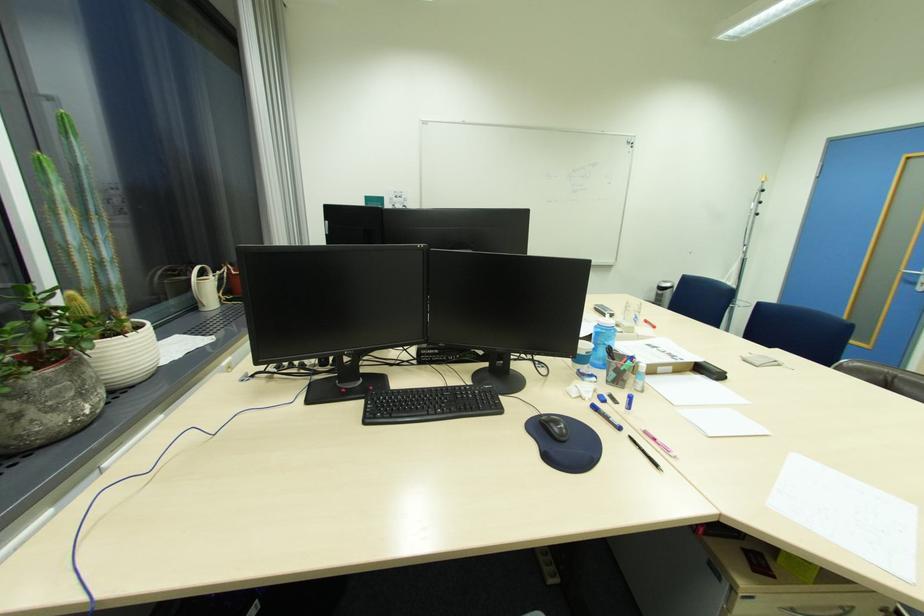
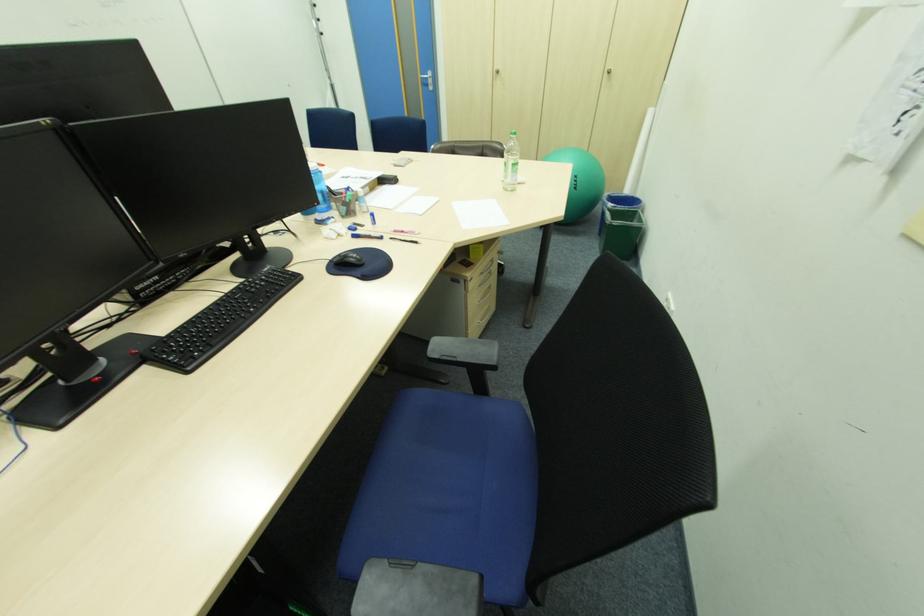
Find the pixel in the second image that matches point (636, 438) in the first image.

(396, 238)